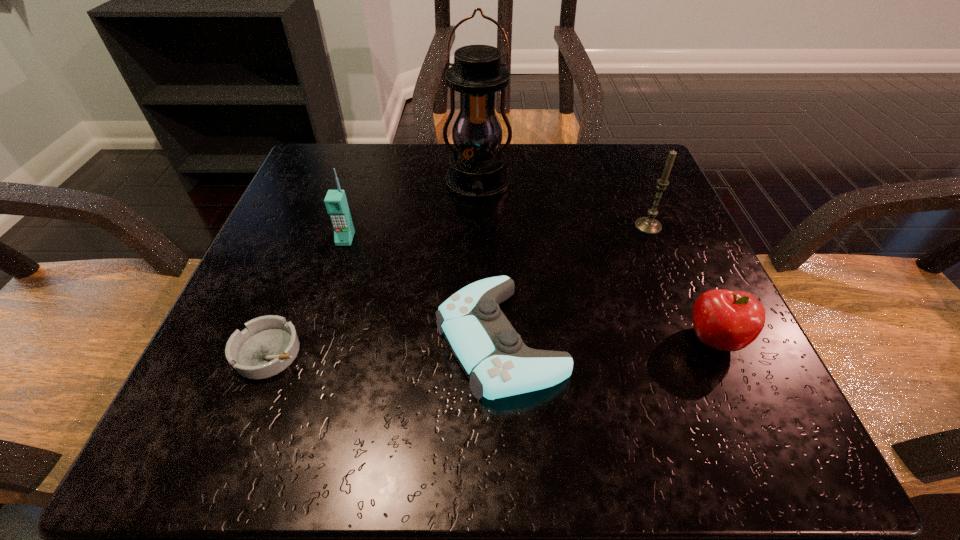
Locate an element on the screen. Image resolution: width=960 pixels, height=540 pixels. free space at the near edge is located at coordinates (652, 460).

In the image, there is a desktop. Identify the location of vacant space at the left edge. (275, 285).

The height and width of the screenshot is (540, 960). In the image, there is a desktop. Identify the location of vacant space at the right edge. (659, 302).

The image size is (960, 540). In the image, there is a desktop. Identify the location of vacant space at the far left corner. click(374, 145).

Where is `vacant space at the far right corner of the desktop`? vacant space at the far right corner of the desktop is located at coordinates (623, 194).

The height and width of the screenshot is (540, 960). In order to click on vacant space at the near right corner of the desktop in this screenshot , I will do `click(715, 443)`.

The image size is (960, 540). Identify the location of vacant point located between the farthest object and the candle. (563, 205).

Find the location of a particular element. The width and height of the screenshot is (960, 540). empty space that is in between the apple and the lantern is located at coordinates (596, 262).

What are the coordinates of `empty location between the apple and the cellular telephone` in the screenshot? It's located at (530, 289).

Locate an element on the screen. vacant region between the apple and the fifth tallest object is located at coordinates (607, 340).